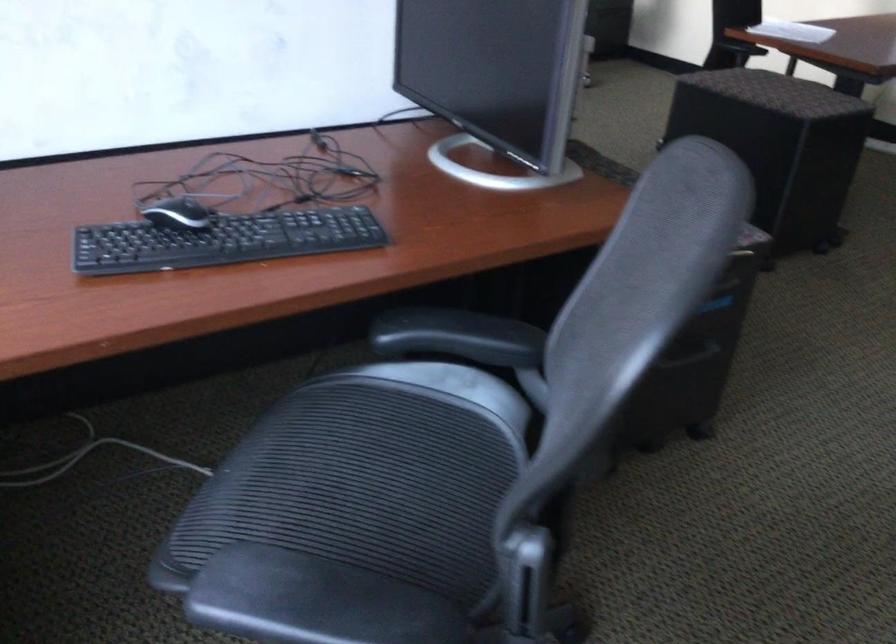
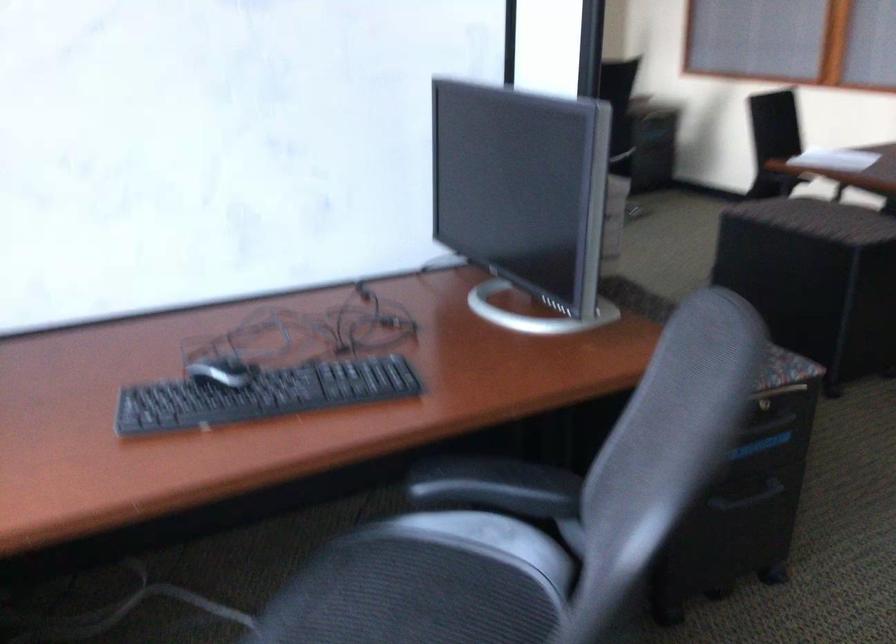
The point at (182, 213) is marked in the first image. Where is the corresponding point in the second image?

(220, 371)